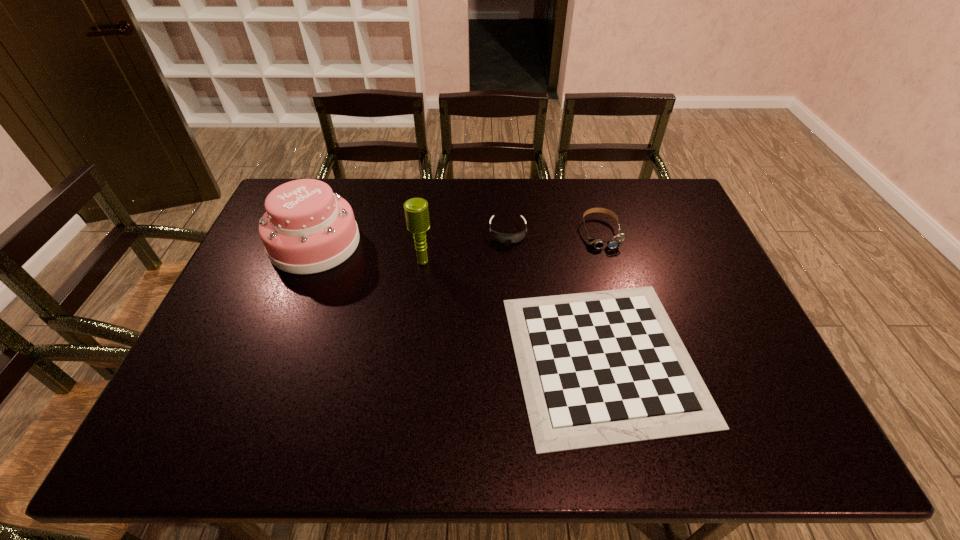
What are the coordinates of `free space located 0.180m on the back of the fourth shortest object` in the screenshot? It's located at (x=338, y=185).

I want to click on vacant space positioned 0.050m on the front-facing side of the right goggles, so click(x=609, y=261).

In order to click on vacant space located 0.070m on the front and sides of the shorter goggles in this screenshot , I will do `click(510, 261)`.

At what (x,y) coordinates should I click in order to perform the action: click on vacant region located on the back of the chessboard. Please return your answer as a coordinate pair (x, y). Looking at the image, I should click on (567, 204).

This screenshot has width=960, height=540. What are the coordinates of `cake present at the far edge` in the screenshot? It's located at (306, 229).

At what (x,y) coordinates should I click in order to perform the action: click on goggles at the far edge. Please return your answer as a coordinate pair (x, y). Looking at the image, I should click on (616, 241).

Where is `object that is at the near edge`? The width and height of the screenshot is (960, 540). object that is at the near edge is located at coordinates (600, 368).

At what (x,y) coordinates should I click in order to perform the action: click on object that is positioned at the left edge. Please return your answer as a coordinate pair (x, y). Looking at the image, I should click on (306, 229).

You are a GUI agent. You are given a task and a screenshot of the screen. Output one action in this format:
    pyautogui.click(x=<x>, y=<y>)
    Task: Click on the object located at the right edge
    
    Given the screenshot: What is the action you would take?
    pyautogui.click(x=600, y=368)

Identify the location of object at the far left corner. The width and height of the screenshot is (960, 540). (306, 229).